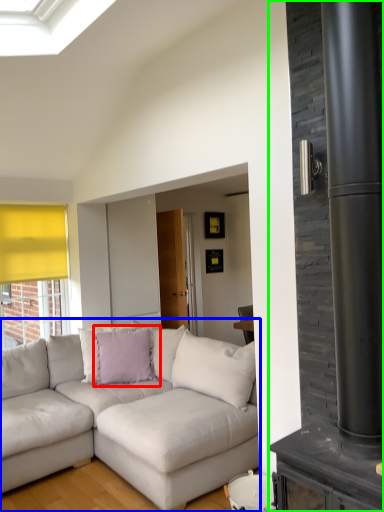
Question: Which object is the closest to the pillow (highlighted by a red box)? Choose among these: studio couch (highlighted by a blue box) or fireplace (highlighted by a green box).

Choices:
 (A) studio couch
 (B) fireplace

Answer: (A)